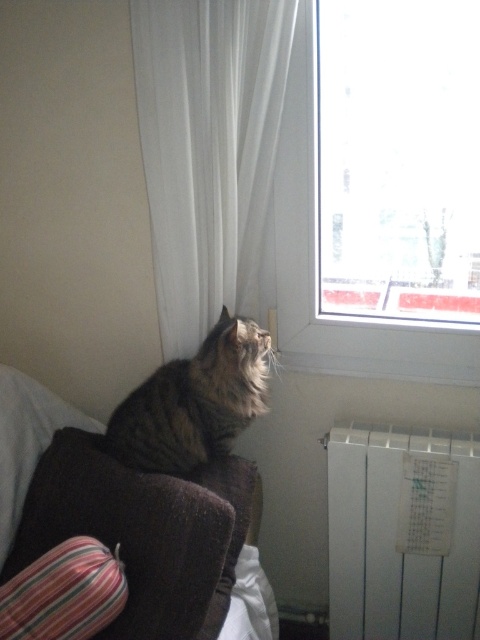
Can you confirm if transparent glass window at upper right is positioned below tabby fur cat at upper left?

Actually, transparent glass window at upper right is above tabby fur cat at upper left.

Which of these two, transparent glass window at upper right or tabby fur cat at upper left, stands shorter?

Standing shorter between the two is tabby fur cat at upper left.

Is point (300, 113) positioned after point (229, 448)?

That is False.

Locate an element on the screen. The width and height of the screenshot is (480, 640). transparent glass window at upper right is located at coordinates (317, 269).

Locate an element on the screen. This screenshot has width=480, height=640. white matte radiator at lower right is located at coordinates (403, 532).

Who is more forward, (331, 502) or (0, 451)?

Point (0, 451) is in front.

Where is `white matte radiator at lower right`? white matte radiator at lower right is located at coordinates (403, 532).

Does white sheer curtain at upper center have a lesser height compared to tabby fur cat at upper left?

Incorrect, white sheer curtain at upper center's height does not fall short of tabby fur cat at upper left's.

Between point (264, 164) and point (262, 336), which one is positioned in front?

Point (264, 164) is in front.

Which is behind, point (186, 250) or point (168, 380)?

Positioned behind is point (186, 250).

At what (x,y) coordinates should I click in order to perform the action: click on white sheer curtain at upper center. Please return your answer as a coordinate pair (x, y). The height and width of the screenshot is (640, 480). Looking at the image, I should click on (208, 148).